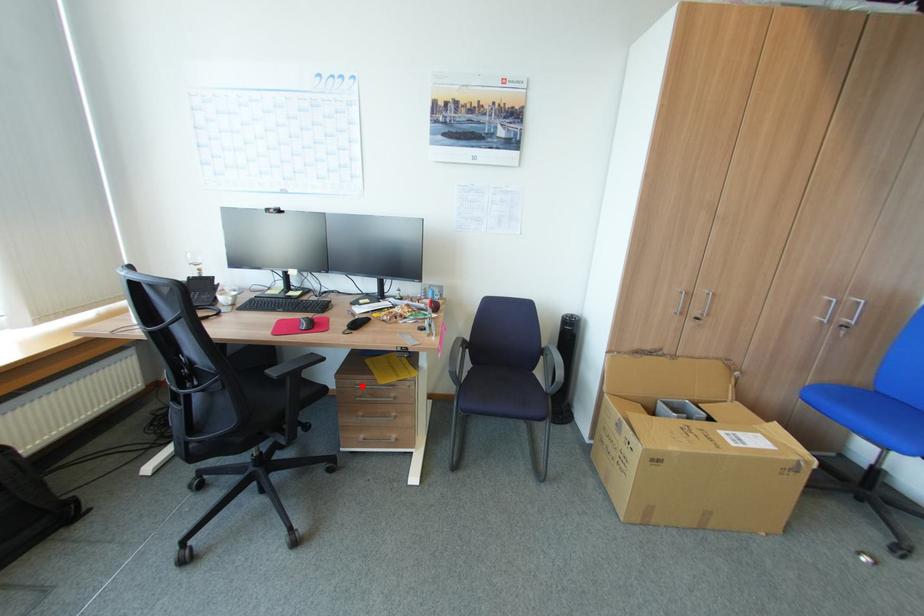
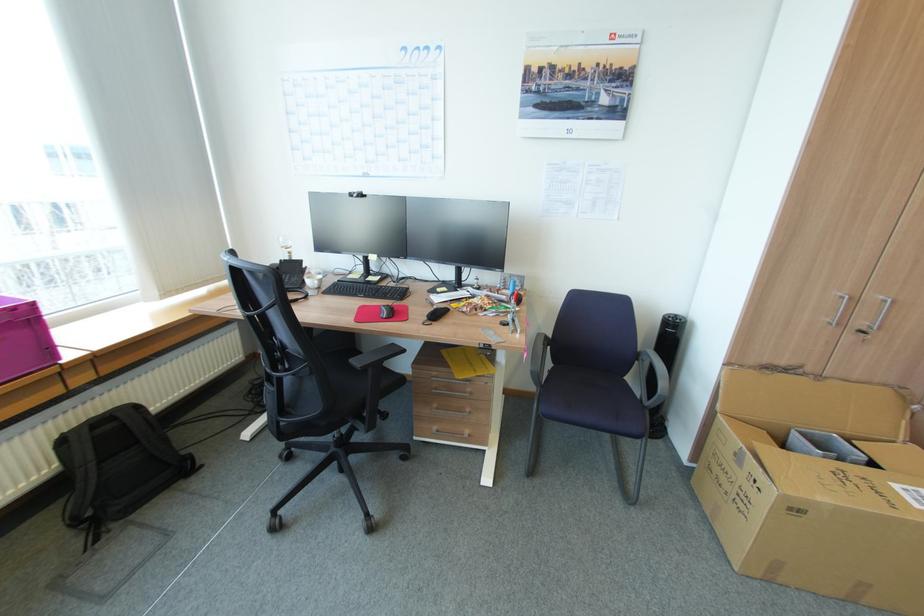
The point at the highlighted location is marked in the first image. Where is the corresponding point in the second image?

(438, 378)